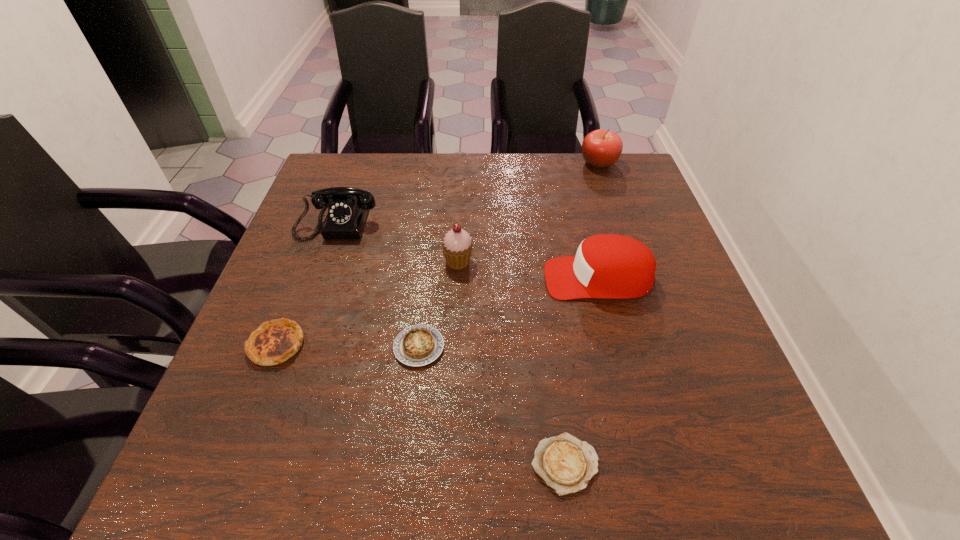
Where is `blank area at the left edge`? blank area at the left edge is located at coordinates (227, 430).

The width and height of the screenshot is (960, 540). I want to click on vacant region at the right edge of the desktop, so pyautogui.click(x=663, y=249).

In the image, there is a desktop. Identify the location of vacant area at the near left corner. (210, 469).

The width and height of the screenshot is (960, 540). In order to click on blank space at the far right corner in this screenshot , I will do `click(624, 156)`.

Locate an element on the screen. free space that is in between the nearest quiche and the telephone is located at coordinates point(452,342).

You are a GUI agent. You are given a task and a screenshot of the screen. Output one action in this format:
    pyautogui.click(x=<x>, y=<y>)
    Task: Click on the free area in between the cupcake and the telephone
    The image size is (960, 540).
    Given the screenshot: What is the action you would take?
    pyautogui.click(x=398, y=240)

This screenshot has height=540, width=960. In order to click on empty space between the farthest object and the baseball cap in this screenshot , I will do `click(598, 221)`.

Where is `vacant area that lies between the shortest object and the sixth tallest object`? vacant area that lies between the shortest object and the sixth tallest object is located at coordinates (492, 406).

You are a GUI agent. You are given a task and a screenshot of the screen. Output one action in this format:
    pyautogui.click(x=<x>, y=<y>)
    Task: Click on the unoccupied position between the baseball cap and the cupcake
    
    Given the screenshot: What is the action you would take?
    pyautogui.click(x=528, y=269)

The image size is (960, 540). Find the location of `unoccupied area between the tallest quiche and the baseball cap`. unoccupied area between the tallest quiche and the baseball cap is located at coordinates (438, 312).